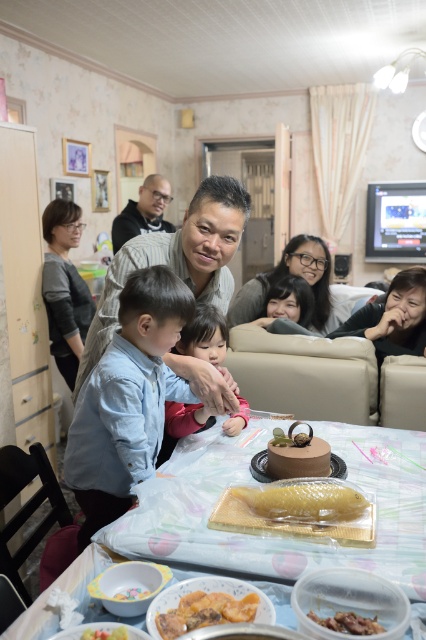
Can you confirm if gray sweater at left is shorter than smooth yellow fish at center?

No, gray sweater at left is not shorter than smooth yellow fish at center.

Does gray sweater at left have a lesser width compared to smooth yellow fish at center?

No, gray sweater at left is not thinner than smooth yellow fish at center.

Identify the location of gray sweater at left. point(65,288).

This screenshot has height=640, width=426. Describe the element at coordinates (204, 336) in the screenshot. I see `light pink fabric at center` at that location.

Where is `light pink fabric at center`? The width and height of the screenshot is (426, 640). light pink fabric at center is located at coordinates coord(204,336).

Can you confirm if brown matte cake at center is shorter than white glossy bowl at lower left?

Incorrect, brown matte cake at center's height does not fall short of white glossy bowl at lower left's.

Is brown matte cake at center positioned in front of white glossy bowl at lower left?

No, brown matte cake at center is behind white glossy bowl at lower left.

Identify the location of brown matte cake at center. (299, 456).